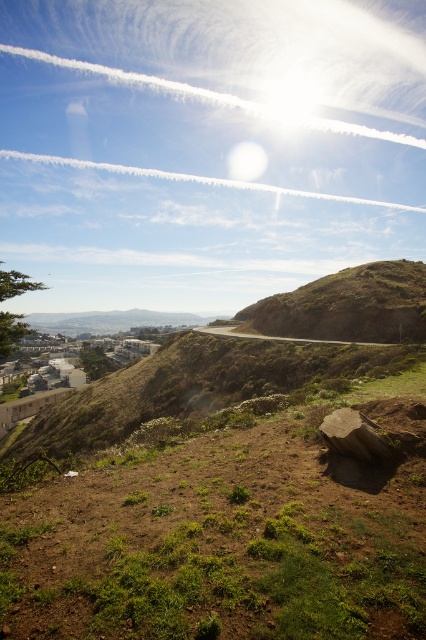
Which is behind, point (106, 468) or point (342, 449)?

The point (106, 468) is more distant.

Is green grassy at center smaller than brown rough rock at lower right?

No.

This screenshot has height=640, width=426. Describe the element at coordinates (229, 536) in the screenshot. I see `green grassy at center` at that location.

You are a GUI agent. You are given a task and a screenshot of the screen. Output one action in this format:
    pyautogui.click(x=<x>, y=<y>)
    Task: Click on the green grassy at center
    
    Given the screenshot: What is the action you would take?
    pyautogui.click(x=229, y=536)

Measure the distance between green grassy hillside at upper right and brown rough rock at lower right.

green grassy hillside at upper right is 75.12 meters away from brown rough rock at lower right.

Does green grassy hillside at upper right appear under brown rough rock at lower right?

Incorrect, green grassy hillside at upper right is not positioned below brown rough rock at lower right.

Does point (345, 276) come closer to viewer compared to point (328, 440)?

No, it is behind (328, 440).

Image resolution: width=426 pixels, height=640 pixels. Identify the location of green grassy hillside at upper right. (348, 305).

Can you confirm if green grassy at center is wider than green grassy hillside at upper right?

No.

How much distance is there between green grassy at center and green grassy hillside at upper right?

A distance of 65.74 meters exists between green grassy at center and green grassy hillside at upper right.

Locate an element on the screen. green grassy at center is located at coordinates (229, 536).

Where is `green grassy at center`? This screenshot has width=426, height=640. green grassy at center is located at coordinates (229, 536).